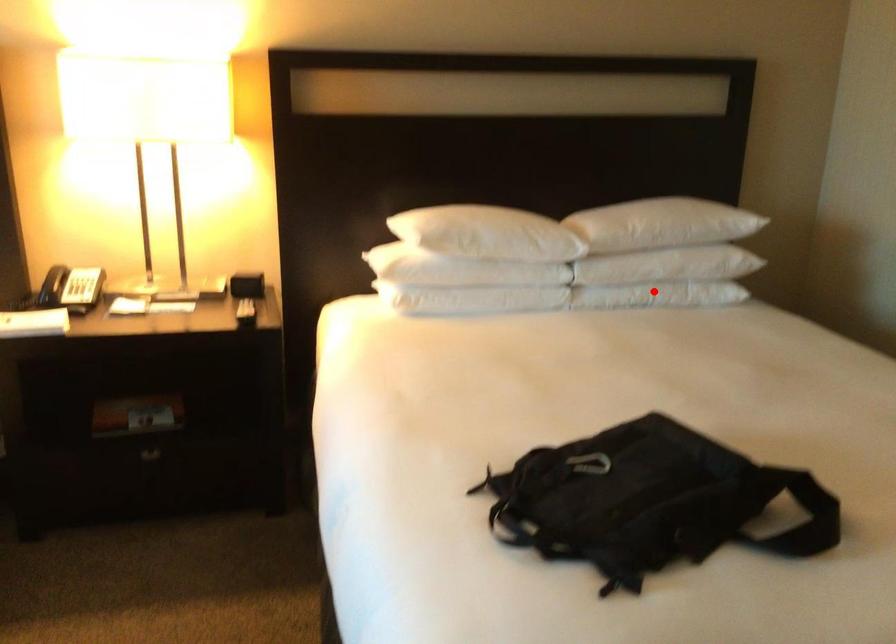
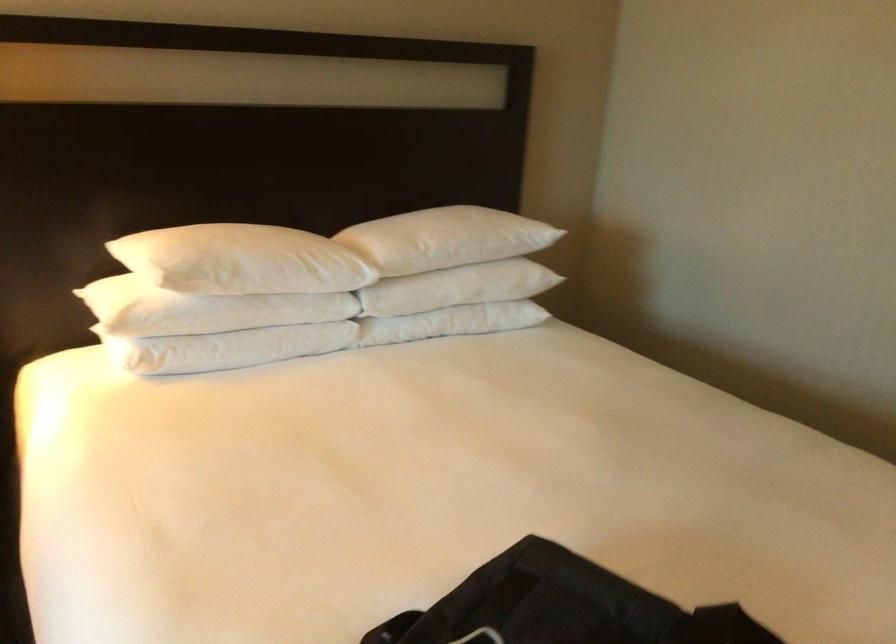
In the second image, find the point that corresponds to the highlighted location in the first image.

(451, 322)